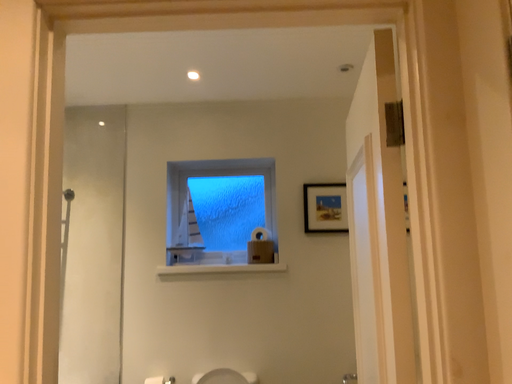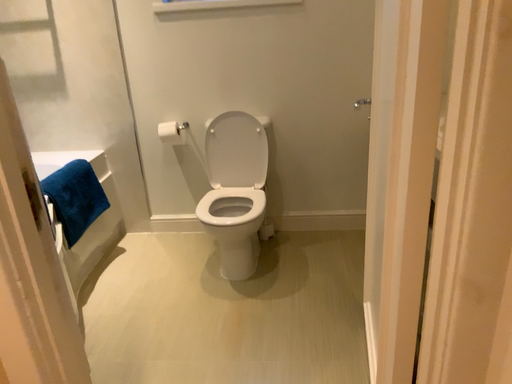
Question: Which way did the camera rotate in the video?

Choices:
 (A) rotated downward
 (B) rotated upward

Answer: (A)